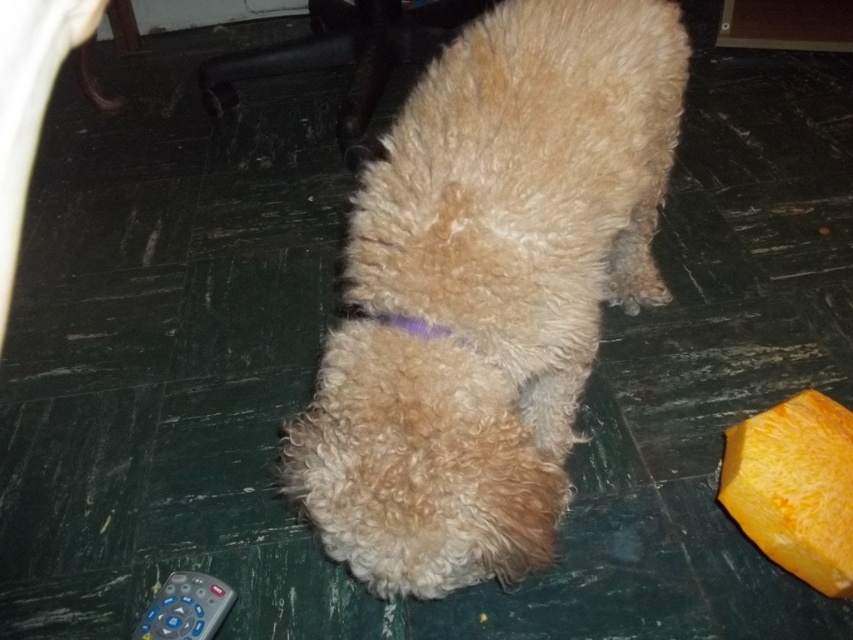
Question: Which point is farther from the camera taking this photo?

Choices:
 (A) (148, 621)
 (B) (498, 134)

Answer: (A)

Question: Is fuzzy beige dog at center wider than gray plastic remote at lower left?

Choices:
 (A) yes
 (B) no

Answer: (A)

Question: Is orange smooth pumpkin at lower right above gray plastic remote at lower left?

Choices:
 (A) yes
 (B) no

Answer: (A)

Question: Among these objects, which one is nearest to the camera?

Choices:
 (A) gray plastic remote at lower left
 (B) orange smooth pumpkin at lower right
 (C) fuzzy beige dog at center

Answer: (C)

Question: Can you confirm if fuzzy beige dog at center is positioned below orange smooth pumpkin at lower right?

Choices:
 (A) no
 (B) yes

Answer: (A)

Question: Among these points, which one is nearest to the camera?

Choices:
 (A) (169, 637)
 (B) (607, 195)
 (C) (730, 513)

Answer: (B)